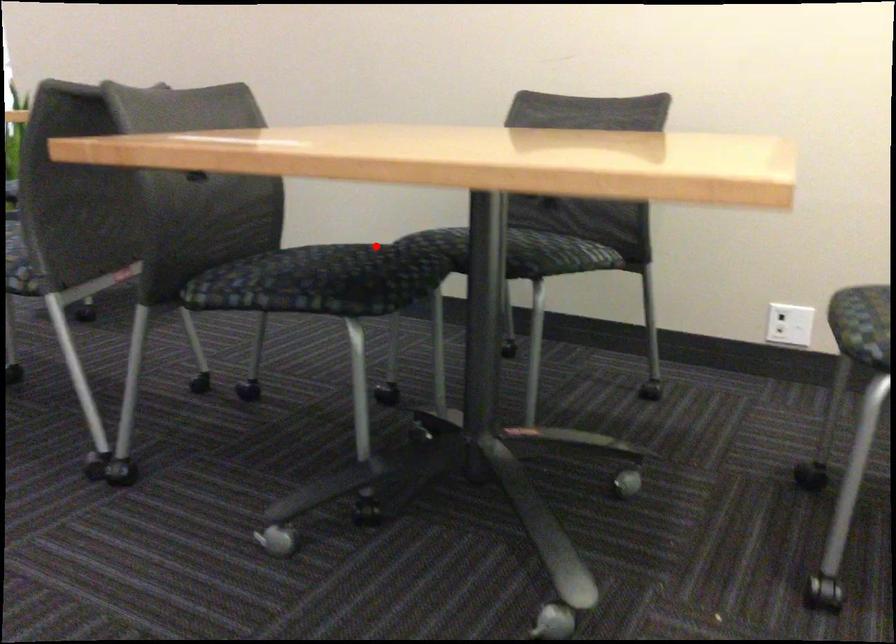
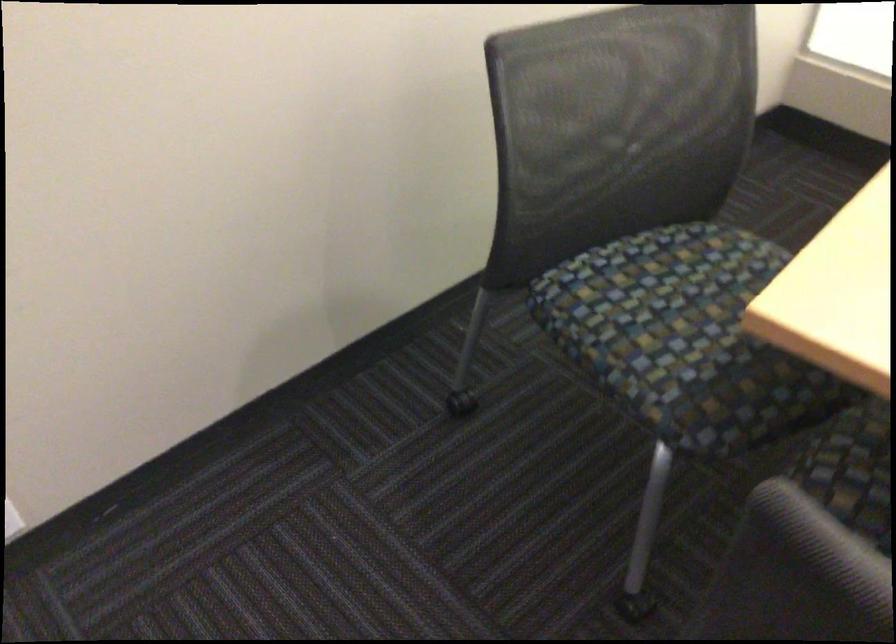
Question: I am providing you with two images of the same scene from different viewpoints. A red point is shown in image1. For the corresponding object point in image2, is it positioned nearer or farther from the camera?

Choices:
 (A) Nearer
 (B) Farther

Answer: (A)